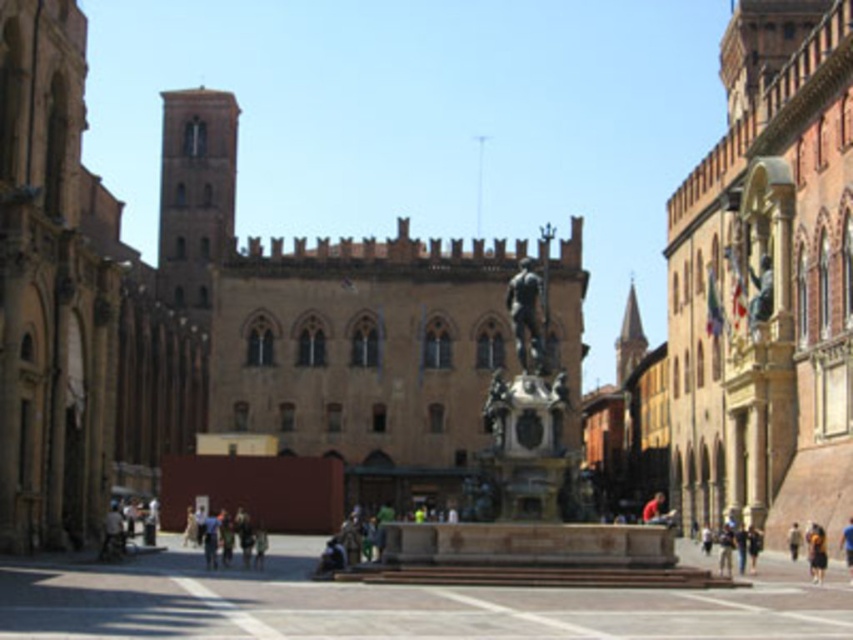
In the scene shown: You are an architect visiting the square and want to take a photo of the brown stone bell tower at upper left and the polished bronze statue at center. Which object should you focus on first to ensure both are in sharp focus?

The brown stone bell tower at upper left is closer to you than the polished bronze statue at center, so you should focus on the brown stone bell tower at upper left first to ensure both are in sharp focus.

You are standing in the urban square and want to take a photo of the fountain. You notice two points marked in the scene. The first point is at coordinates point (196, 147) and the second is at point (531, 296). Which point is closer to your camera position?

Point (196, 147) is further to the camera than point (531, 296), so the second point is closer to the camera position.